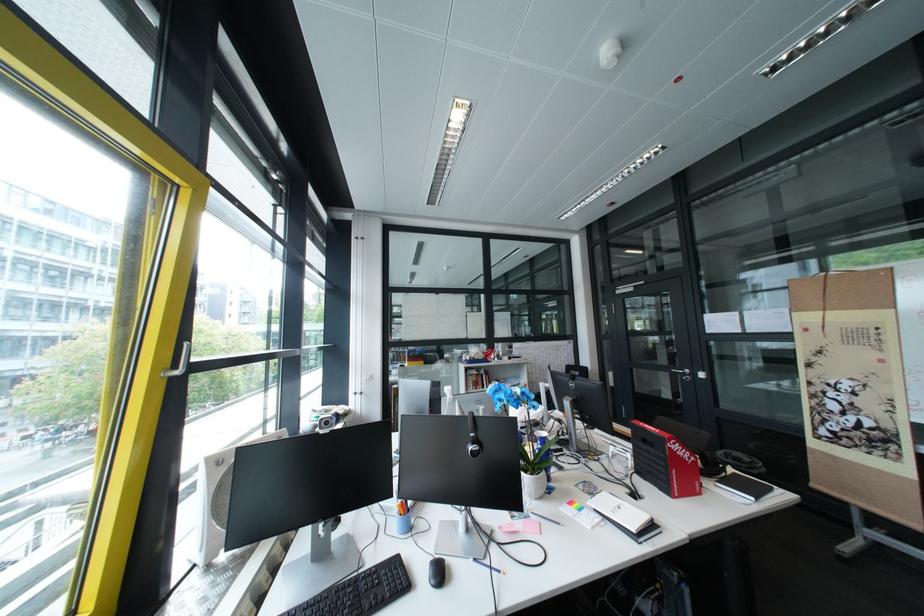
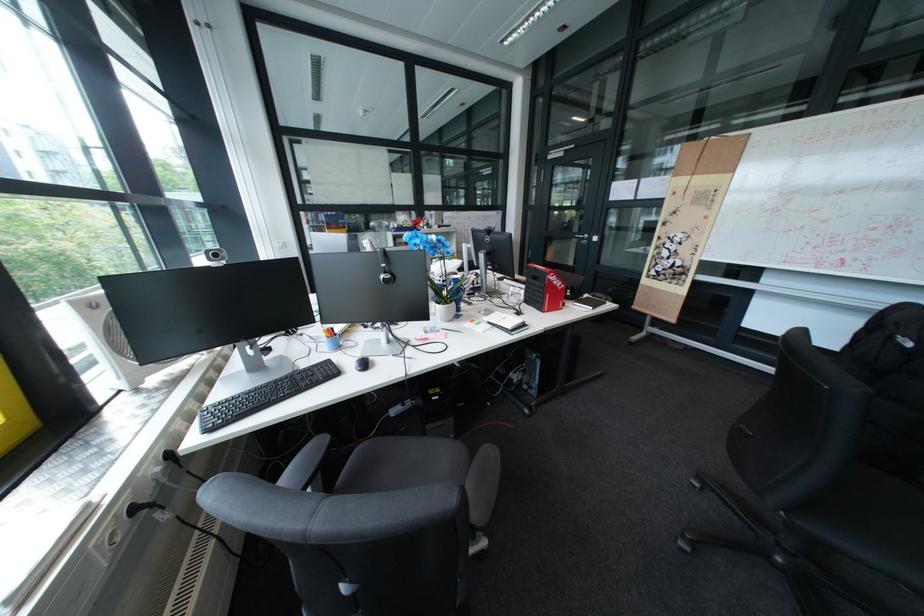
Find the pixel in the second image that matches pixel 542 469 in the first image.

(456, 302)